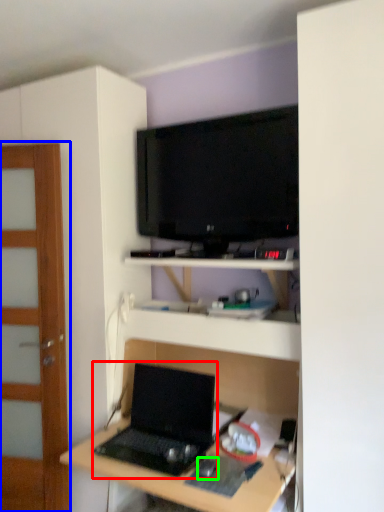
Question: Estimate the real-world distances between objects in this image. Which object is closer to laptop (highlighted by a red box), door (highlighted by a blue box) or mouse (highlighted by a green box)?

Choices:
 (A) door
 (B) mouse

Answer: (B)